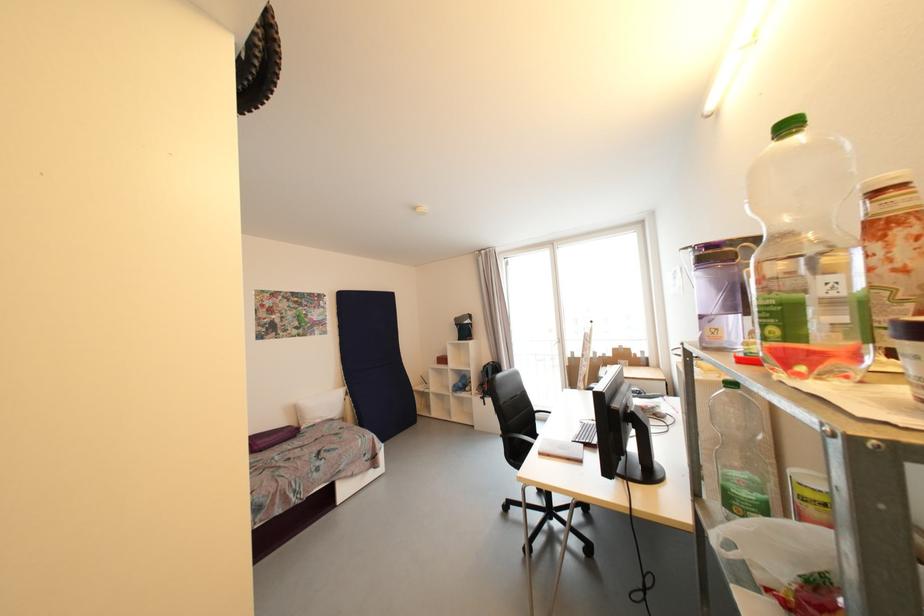
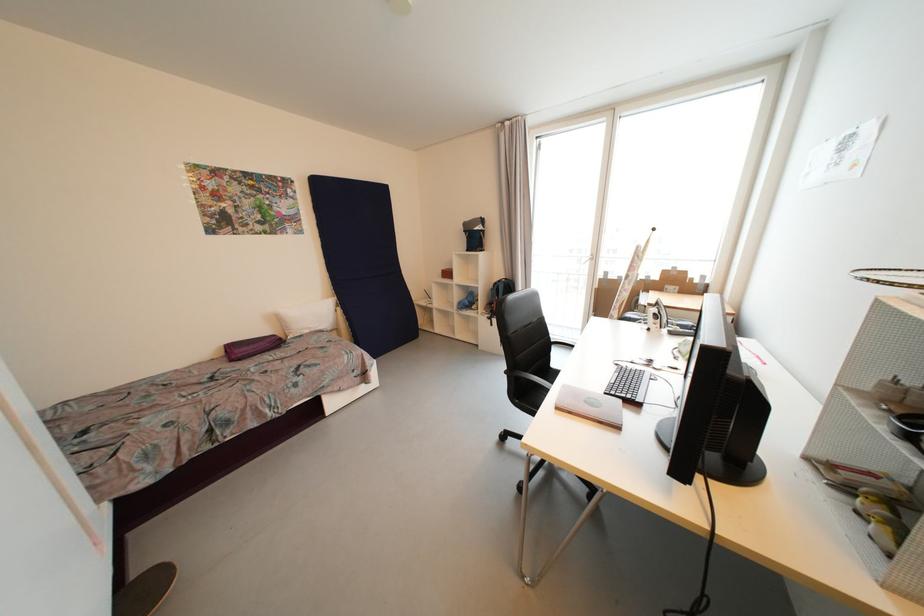
The point at [353,399] is marked in the first image. Where is the corresponding point in the second image?

(344, 310)